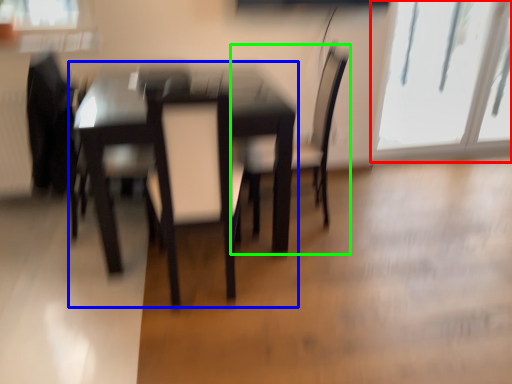
Question: Considering the real-world distances, which object is closest to window (highlighted by a red box)? table (highlighted by a blue box) or chair (highlighted by a green box).

Choices:
 (A) table
 (B) chair

Answer: (B)